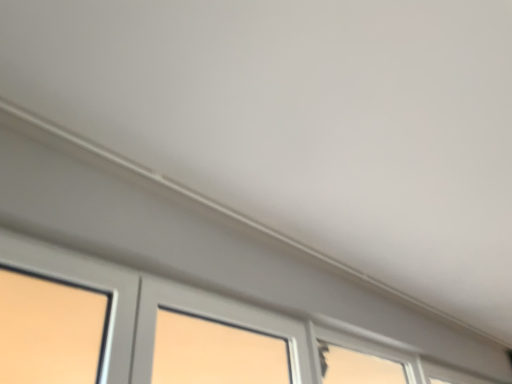
Question: Considering the relative positions of transparent glass window at lower right, arranged as the second window when viewed from the right, and matte gray window at lower left, the 1th window in the front-to-back sequence, in the image provided, is transparent glass window at lower right, arranged as the second window when viewed from the right, to the left of matte gray window at lower left, the 1th window in the front-to-back sequence, from the viewer's perspective?

Choices:
 (A) yes
 (B) no

Answer: (B)

Question: From the image's perspective, is transparent glass window at lower right, which ranks as the second window in back-to-front order, located above matte gray window at lower left, the third window from the back?

Choices:
 (A) no
 (B) yes

Answer: (A)

Question: Could matte gray window at lower left, the 3th window viewed from the right, be considered to be inside transparent glass window at lower right, arranged as the second window when viewed from the right?

Choices:
 (A) no
 (B) yes

Answer: (A)

Question: Considering the relative sizes of transparent glass window at lower right, which ranks as the second window in back-to-front order, and matte gray window at lower left, the 3th window viewed from the right, in the image provided, is transparent glass window at lower right, which ranks as the second window in back-to-front order, wider than matte gray window at lower left, the 3th window viewed from the right,?

Choices:
 (A) yes
 (B) no

Answer: (A)

Question: Does transparent glass window at lower right, the second window viewed from the left, have a lesser width compared to matte gray window at lower left, the 1th window in the front-to-back sequence?

Choices:
 (A) no
 (B) yes

Answer: (A)

Question: Can you confirm if transparent glass window at lower right, arranged as the second window when viewed from the right, is smaller than matte gray window at lower left, the 1th window in the front-to-back sequence?

Choices:
 (A) yes
 (B) no

Answer: (A)

Question: From a real-world perspective, is clear glass window at lower right, which ranks as the first window in back-to-front order, located beneath matte gray window at lower left, the 1th window in the front-to-back sequence?

Choices:
 (A) no
 (B) yes

Answer: (A)

Question: Is clear glass window at lower right, marked as the 3th window in a front-to-back arrangement, wider than matte gray window at lower left, placed as the first window when sorted from left to right?

Choices:
 (A) yes
 (B) no

Answer: (B)

Question: Does clear glass window at lower right, marked as the 3th window in a front-to-back arrangement, appear on the left side of matte gray window at lower left, the third window from the back?

Choices:
 (A) no
 (B) yes

Answer: (A)

Question: Is clear glass window at lower right, which ranks as the first window in back-to-front order, positioned in front of matte gray window at lower left, the 3th window viewed from the right?

Choices:
 (A) no
 (B) yes

Answer: (A)

Question: From the image's perspective, is clear glass window at lower right, which ranks as the first window in back-to-front order, on top of matte gray window at lower left, placed as the first window when sorted from left to right?

Choices:
 (A) no
 (B) yes

Answer: (A)

Question: Can you confirm if clear glass window at lower right, marked as the 3th window in a front-to-back arrangement, is bigger than matte gray window at lower left, the third window from the back?

Choices:
 (A) no
 (B) yes

Answer: (A)

Question: Can you confirm if matte gray window at lower left, placed as the first window when sorted from left to right, is shorter than clear glass window at lower right, marked as the 3th window in a front-to-back arrangement?

Choices:
 (A) yes
 (B) no

Answer: (B)